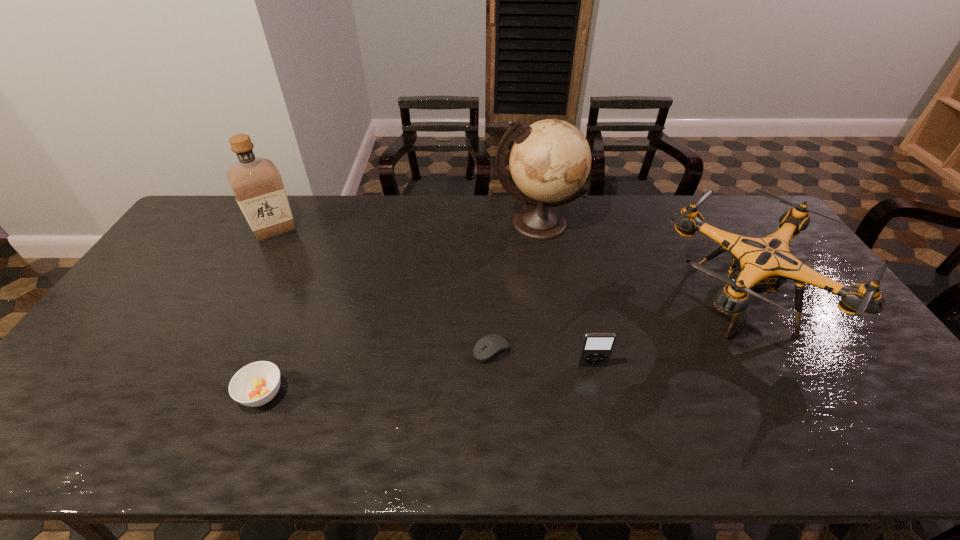
The height and width of the screenshot is (540, 960). In order to click on globe in this screenshot , I will do `click(550, 160)`.

Where is `the leftmost object`? the leftmost object is located at coordinates (256, 183).

Locate an element on the screen. Image resolution: width=960 pixels, height=540 pixels. drone is located at coordinates (760, 265).

Find the location of `the rightmost object`. the rightmost object is located at coordinates (760, 265).

Find the location of a particular element. The width and height of the screenshot is (960, 540). the fourth tallest object is located at coordinates (596, 349).

Image resolution: width=960 pixels, height=540 pixels. I want to click on the second object from left to right, so point(255,384).

You are a GUI agent. You are given a task and a screenshot of the screen. Output one action in this format:
    pyautogui.click(x=<x>, y=<y>)
    Task: Click on the fifth tallest object
    This screenshot has height=540, width=960.
    Given the screenshot: What is the action you would take?
    pyautogui.click(x=255, y=384)

I want to click on the shortest object, so click(491, 347).

Locate an element on the screen. Image resolution: width=960 pixels, height=540 pixels. vacant point located on the front-facing side of the globe is located at coordinates (542, 256).

Find the location of a particular element. This screenshot has width=960, height=540. vacant space located 0.310m on the front-facing side of the leftmost object is located at coordinates (229, 314).